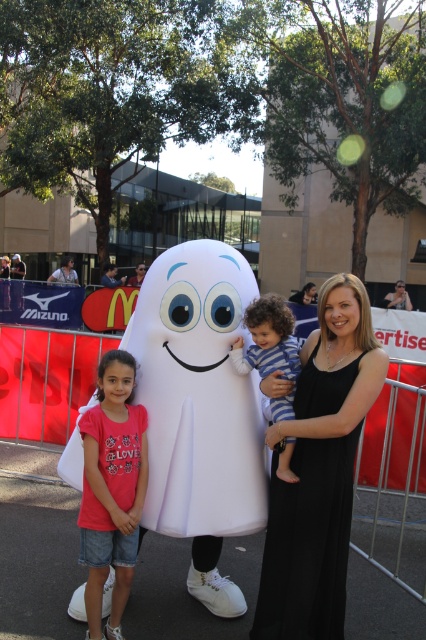
The width and height of the screenshot is (426, 640). Describe the element at coordinates (307, 541) in the screenshot. I see `black satin dress at center` at that location.

Is black satin dress at center positioned at the back of matte pink shirt at left?

No, it is not.

The height and width of the screenshot is (640, 426). Describe the element at coordinates (307, 541) in the screenshot. I see `black satin dress at center` at that location.

The image size is (426, 640). Find the location of `black satin dress at center`. black satin dress at center is located at coordinates (307, 541).

Between black satin dress at center and blue striped pajamas at center, which one is positioned higher?

blue striped pajamas at center is higher up.

Is black satin dress at center shorter than blue striped pajamas at center?

No, black satin dress at center is not shorter than blue striped pajamas at center.

At what (x,y) coordinates should I click in order to perform the action: click on black satin dress at center. Please return your answer as a coordinate pair (x, y). This screenshot has width=426, height=640. Looking at the image, I should click on (307, 541).

Can you confirm if matte pink shirt at left is shorter than blue striped pajamas at center?

In fact, matte pink shirt at left may be taller than blue striped pajamas at center.

From the picture: Who is shorter, matte pink shirt at left or blue striped pajamas at center?

Standing shorter between the two is blue striped pajamas at center.

The image size is (426, 640). In order to click on matte pink shirt at left in this screenshot , I will do `click(112, 488)`.